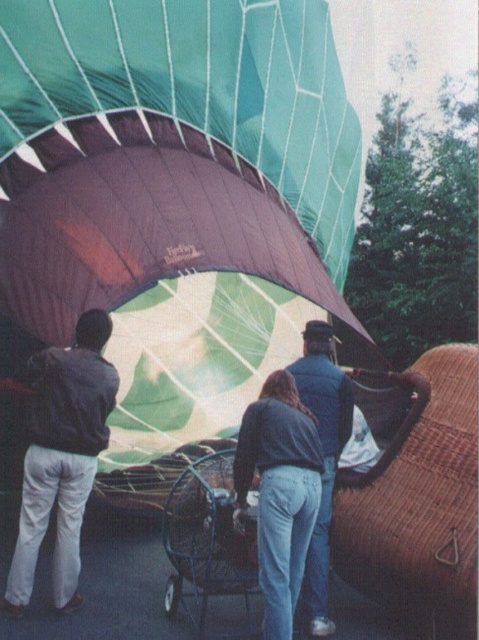
You are standing in front of the hot air balloon inflation scene. There are two points marked in the image. The first point is at coordinates point (275, 376) and the second point is at point (77, 348). Which of these two points is closer to you?

Point (275, 376) is closer to the viewer than point (77, 348).

You are a photographer positioned at the center of the scene. You need to capture a photo that includes both the denim jacket at center and the metallic silver baby carriage at center. Which object should you adjust your camera angle to include first if you want to frame them both properly?

The denim jacket at center is to the right of the metallic silver baby carriage at center, so you should adjust your camera angle to include the metallic silver baby carriage at center first, then pan slightly to the right to include the denim jacket at center in the frame.

You are a photographer positioned behind the denim jacket at center and the dark blue jacket at left. Which jacket will block your view of the other?

The denim jacket at center is in front of dark blue jacket at left, so the denim jacket at center will block your view of the dark blue jacket at left.